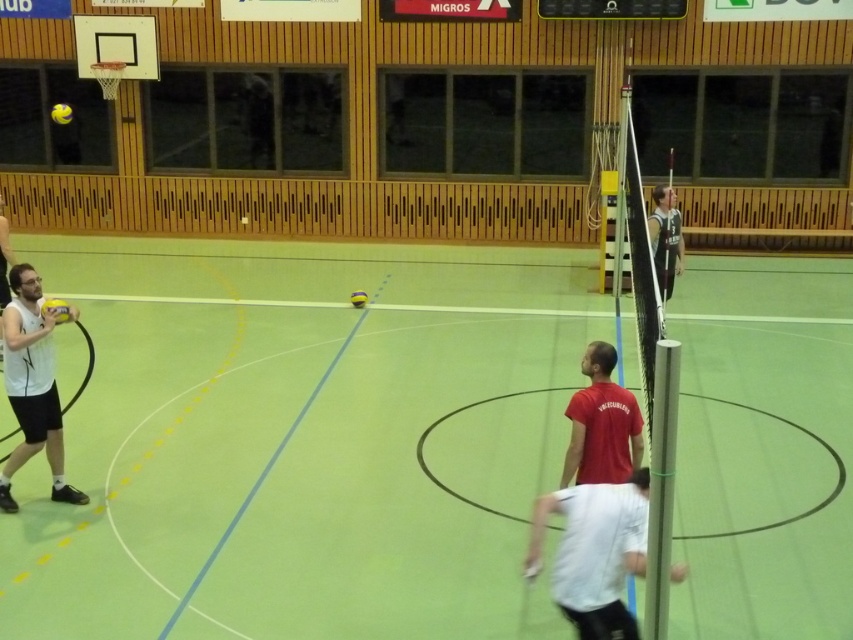
Question: Which point is farther to the camera?

Choices:
 (A) (68, 116)
 (B) (352, 301)

Answer: (A)

Question: Which object is the farthest from the yellow matte/vinyl volleyball at upper left?

Choices:
 (A) white matte/vinyl volleyball at left
 (B) white matte shirt at lower center
 (C) red matte shirt at center
 (D) yellow matte volleyball at left

Answer: (B)

Question: Is white matte shirt at lower center bigger than yellow matte volleyball at left?

Choices:
 (A) no
 (B) yes

Answer: (B)

Question: Observing the image, what is the correct spatial positioning of white matte shirt at lower center in reference to yellow matte/vinyl volleyball at upper left?

Choices:
 (A) right
 (B) left

Answer: (A)

Question: Is yellow matte volleyball at left thinner than yellow matte/vinyl volleyball at center?

Choices:
 (A) no
 (B) yes

Answer: (A)

Question: Which object is farther from the camera taking this photo?

Choices:
 (A) yellow matte/vinyl volleyball at upper left
 (B) white matte shirt at lower center
 (C) yellow matte/vinyl volleyball at center
 (D) white matte/vinyl volleyball at left

Answer: (A)